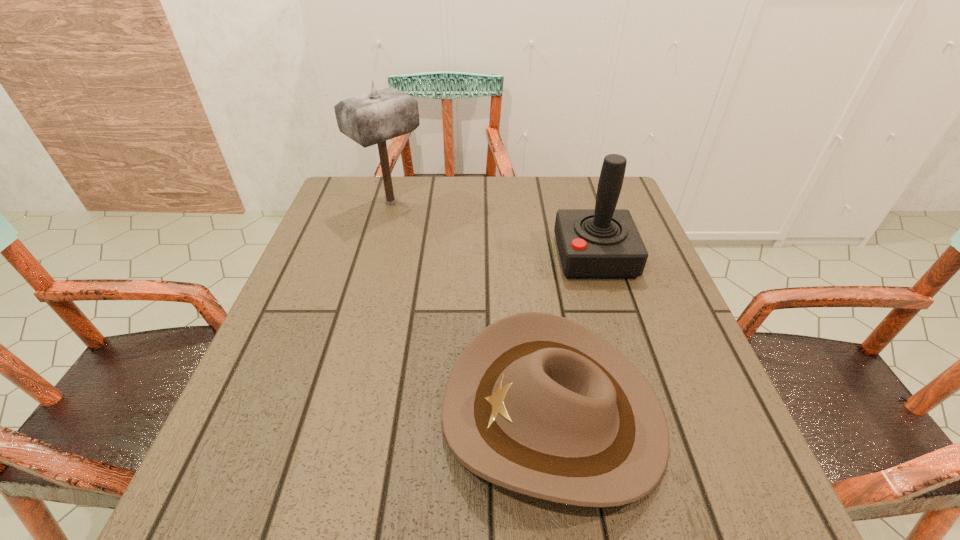
This screenshot has width=960, height=540. Identify the location of vacant space at the far edge. (455, 195).

You are a GUI agent. You are given a task and a screenshot of the screen. Output one action in this format:
    pyautogui.click(x=<x>, y=<y>)
    Task: Click on the vacant space at the left edge of the desktop
    
    Given the screenshot: What is the action you would take?
    324,267

Identify the location of free point at the right edge. The image size is (960, 540). (741, 444).

This screenshot has width=960, height=540. In order to click on free space at the near left corner of the desktop in this screenshot , I will do `click(233, 527)`.

In order to click on vacant space at the far right corner of the desktop in this screenshot , I will do [588, 202].

This screenshot has width=960, height=540. Find the location of `blank space at the near right corner`. blank space at the near right corner is located at coordinates (725, 495).

I want to click on vacant area that lies between the leftmost object and the cowboy hat, so click(x=472, y=308).

The image size is (960, 540). Identify the location of free space between the mallet and the nearest object. (472, 308).

At what (x,y) coordinates should I click in order to perform the action: click on free spot between the shortest object and the tallest object. Please return your answer as a coordinate pair (x, y). The width and height of the screenshot is (960, 540). Looking at the image, I should click on (472, 308).

Find the location of a particular element. unoccupied area between the second shortest object and the leftmost object is located at coordinates (492, 230).